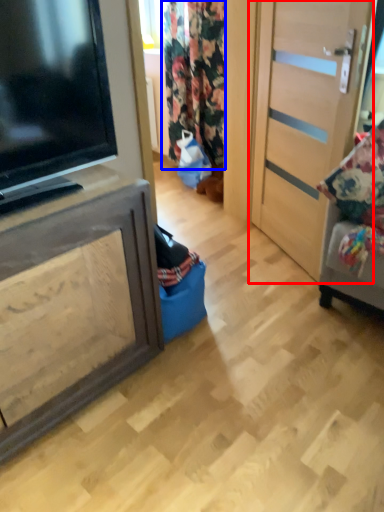
Question: Among these objects, which one is farthest to the camera, door (highlighted by a red box) or curtain (highlighted by a blue box)?

Choices:
 (A) door
 (B) curtain

Answer: (B)